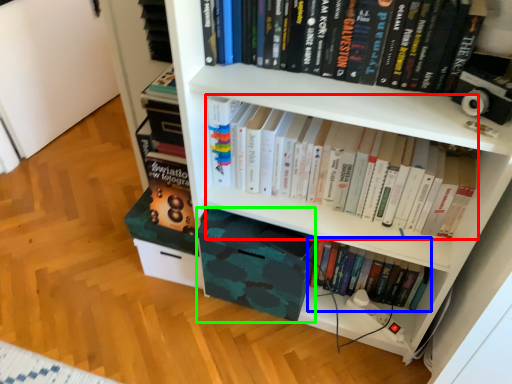
Question: Based on their relative distances, which object is farther from book (highlighted by a red box)? Choose from book (highlighted by a blue box) and book cover (highlighted by a green box).

Choices:
 (A) book
 (B) book cover

Answer: (A)